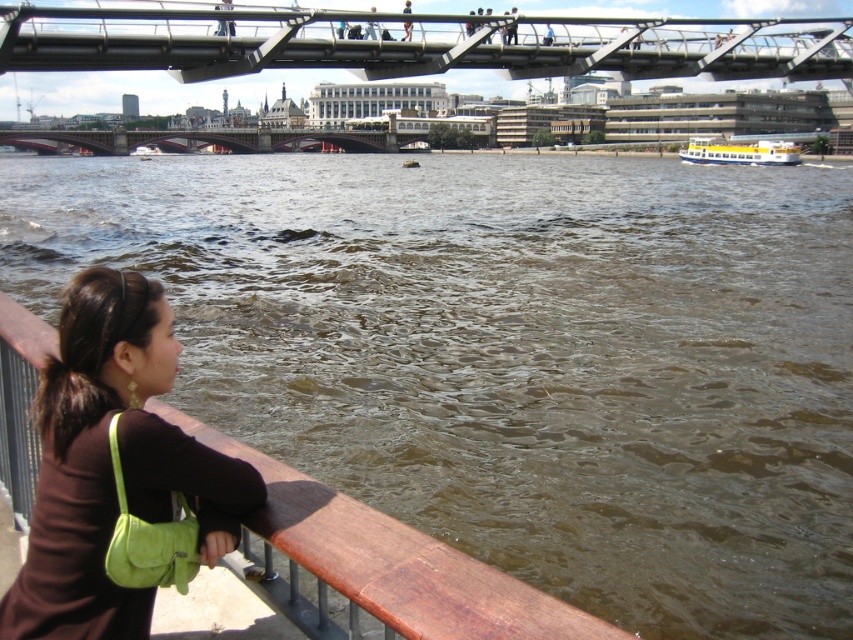
Question: Is brown suede purse at lower left below green suede shoulder bag at lower left?

Choices:
 (A) no
 (B) yes

Answer: (A)

Question: Which of the following is the closest to the observer?

Choices:
 (A) yellow matte boat at right
 (B) dark brown hair at lower left

Answer: (B)

Question: Does dark red stone bridge at center come behind yellow matte boat at right?

Choices:
 (A) no
 (B) yes

Answer: (B)

Question: Considering the real-world distances, which object is farthest from the dark brown hair at lower left?

Choices:
 (A) green suede shoulder bag at lower left
 (B) brown suede purse at lower left
 (C) metallic gray bridge at upper center

Answer: (C)

Question: Which point is farther to the camera?

Choices:
 (A) (698, 154)
 (B) (44, 381)

Answer: (A)

Question: Is metallic gray bridge at upper center smaller than brown suede purse at lower left?

Choices:
 (A) yes
 (B) no

Answer: (B)